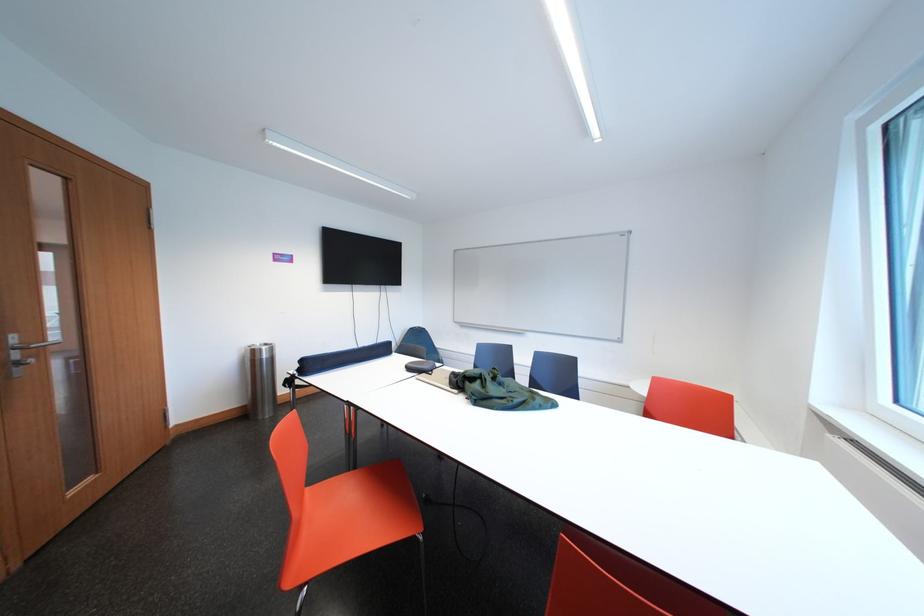
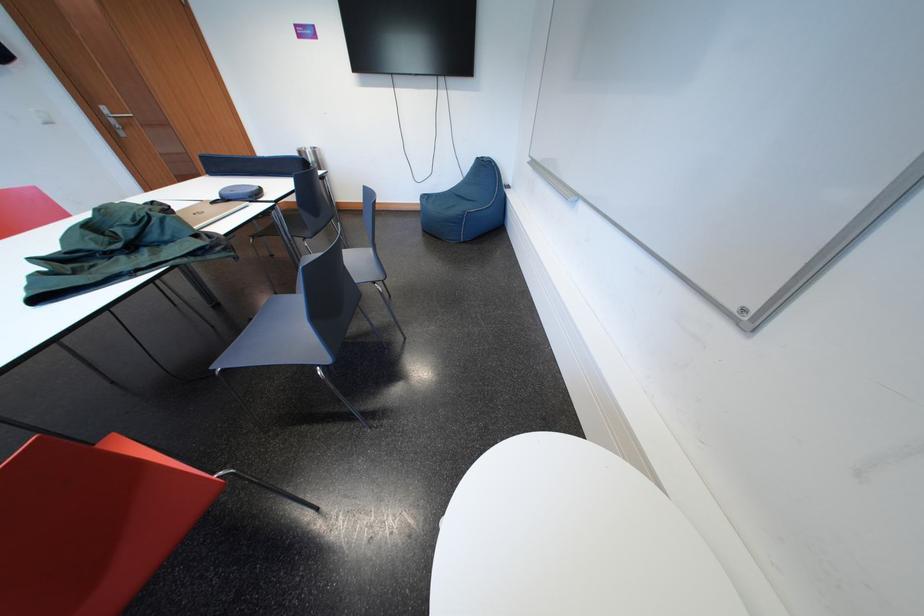
Find the pixel in the second image that matches [263,357] in the first image.

(309, 158)